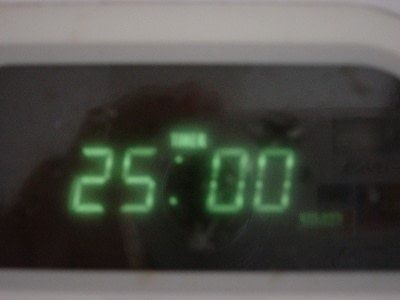
You are a GUI agent. You are given a task and a screenshot of the screen. Output one action in this format:
    pyautogui.click(x=<x>, y=<y>)
    Task: Click on the white clock housing
    
    Given the screenshot: What is the action you would take?
    pos(227,33)